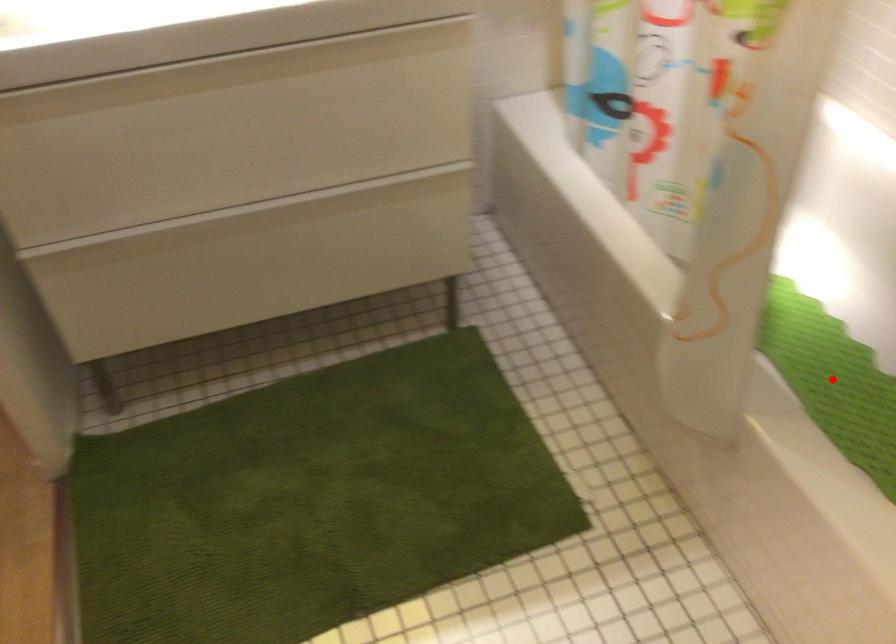
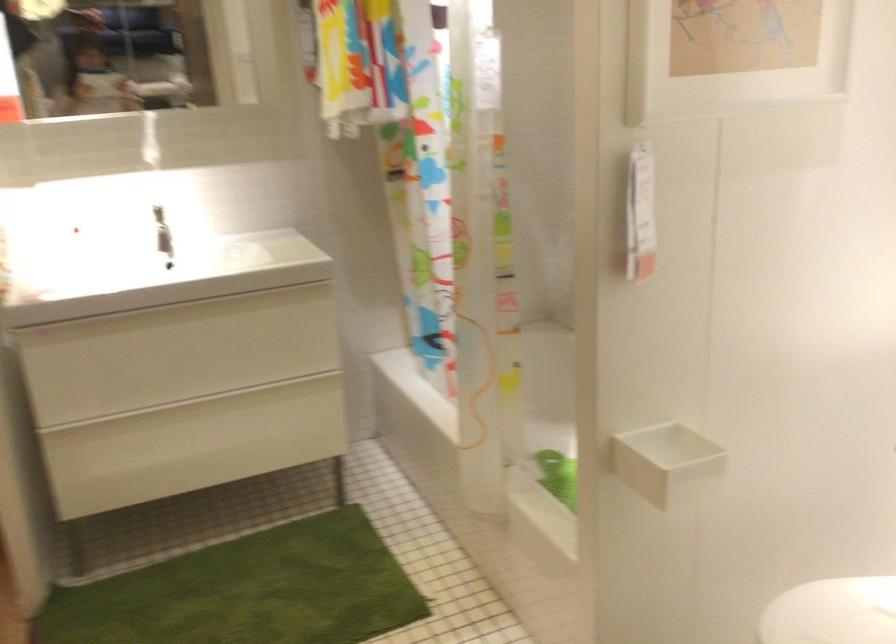
Question: I am providing you with two images of the same scene from different viewpoints. A red point is marked on the first image. Can you still see the location of the red point in image 2?

Choices:
 (A) Yes
 (B) No

Answer: (B)